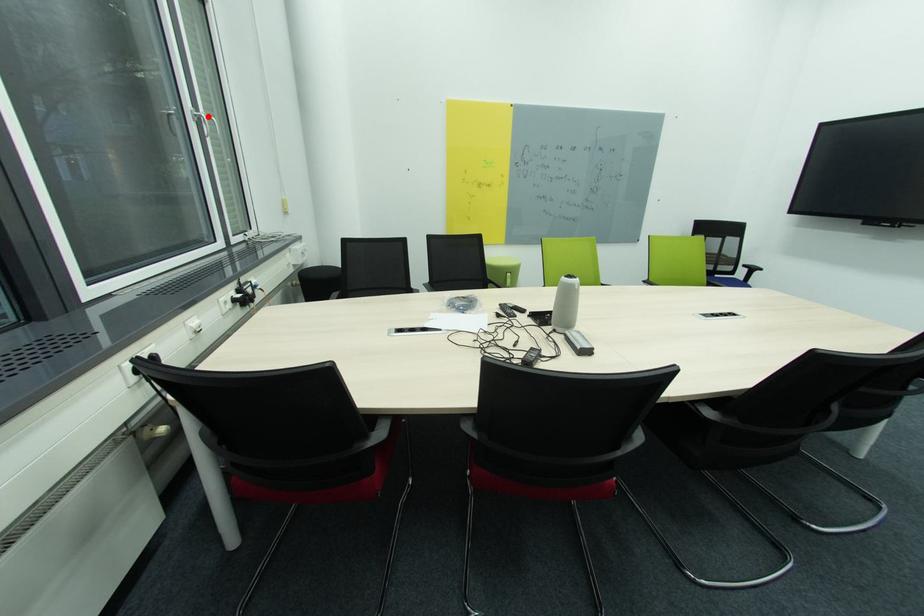
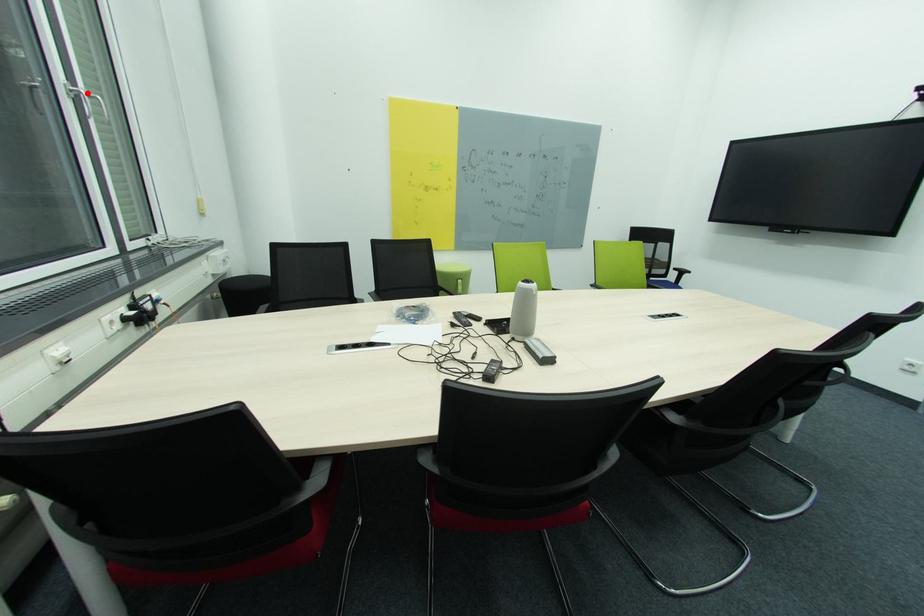
I am providing you with two images of the same scene from different viewpoints. A red point is marked on the first image and another point is marked on the second image. Does the point marked in image1 correspond to the same location as the one in image2?

Yes